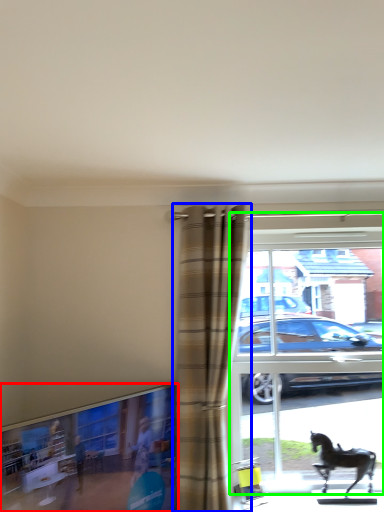
Question: Which is farther away from window frame (highlighted by a red box)? curtain (highlighted by a blue box) or window (highlighted by a green box)?

Choices:
 (A) curtain
 (B) window

Answer: (B)